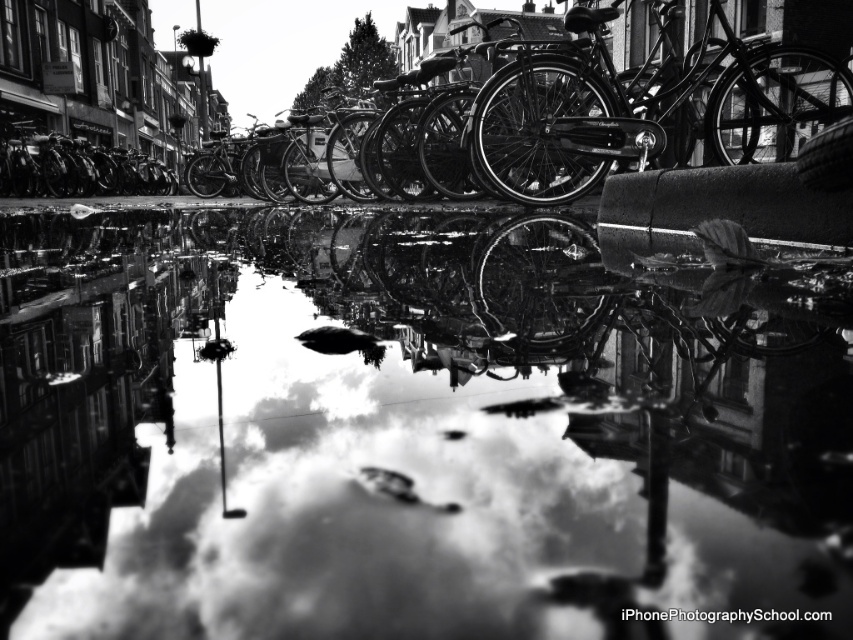
Question: Does reflective water at center appear under shiny black bicycle at left?

Choices:
 (A) yes
 (B) no

Answer: (A)

Question: Is reflective water at center to the left of shiny black bicycle at left from the viewer's perspective?

Choices:
 (A) yes
 (B) no

Answer: (B)

Question: Which point is farther to the camera?

Choices:
 (A) shiny black bicycle at left
 (B) reflective water at center
 (C) polished metal bicycle at center

Answer: (A)

Question: Among these points, which one is farthest from the camera?

Choices:
 (A) (318, 324)
 (B) (151, 157)
 (C) (633, 116)

Answer: (B)

Question: Is reflective water at center positioned in front of polished metal bicycle at center?

Choices:
 (A) yes
 (B) no

Answer: (A)

Question: Which object is closer to the camera taking this photo?

Choices:
 (A) shiny black bicycle at left
 (B) polished metal bicycle at center

Answer: (B)